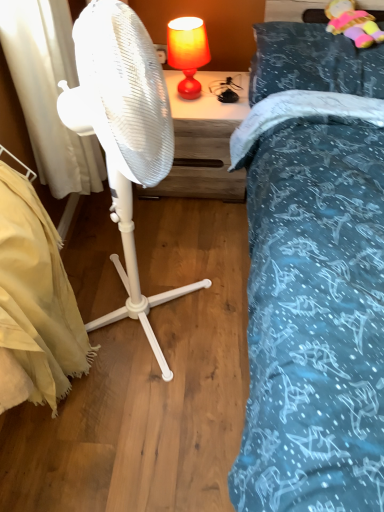
At what (x,y) coordinates should I click in order to perform the action: click on vacant space in front of matte orange lampshade at upper center. Please return your answer as a coordinate pair (x, y). The width and height of the screenshot is (384, 512). Looking at the image, I should click on (196, 116).